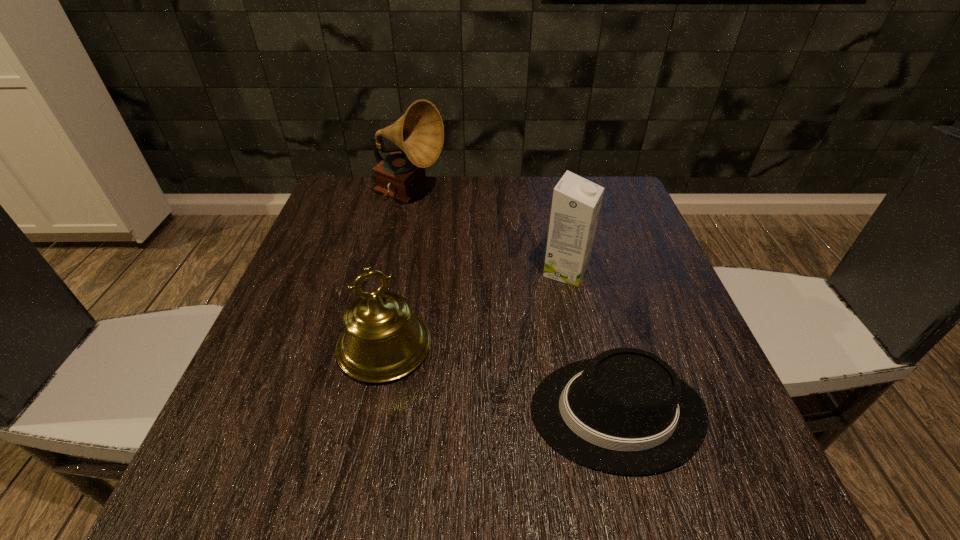
Locate an element on the screen. phonograph record is located at coordinates (419, 133).

The width and height of the screenshot is (960, 540). I want to click on the tallest object, so click(419, 133).

In order to click on the second farthest object in this screenshot , I will do `click(576, 203)`.

Locate an element on the screen. The width and height of the screenshot is (960, 540). bell is located at coordinates (383, 341).

Where is `the shortest object`? the shortest object is located at coordinates (625, 411).

Where is `free space located on the horn of the tallest object`? The width and height of the screenshot is (960, 540). free space located on the horn of the tallest object is located at coordinates (496, 195).

At what (x,y) coordinates should I click in order to perform the action: click on vacant space situated on the back of the third nearest object. Please return your answer as a coordinate pair (x, y). The width and height of the screenshot is (960, 540). Looking at the image, I should click on (545, 177).

Identify the location of vacant point located 0.330m on the right of the bell. (615, 347).

At what (x,y) coordinates should I click in order to perform the action: click on free location located on the front-facing side of the fedora. Please return your answer as a coordinate pair (x, y). The height and width of the screenshot is (540, 960). Looking at the image, I should click on (378, 412).

Locate an element on the screen. vacant space situated 0.130m on the front-facing side of the fedora is located at coordinates (448, 412).